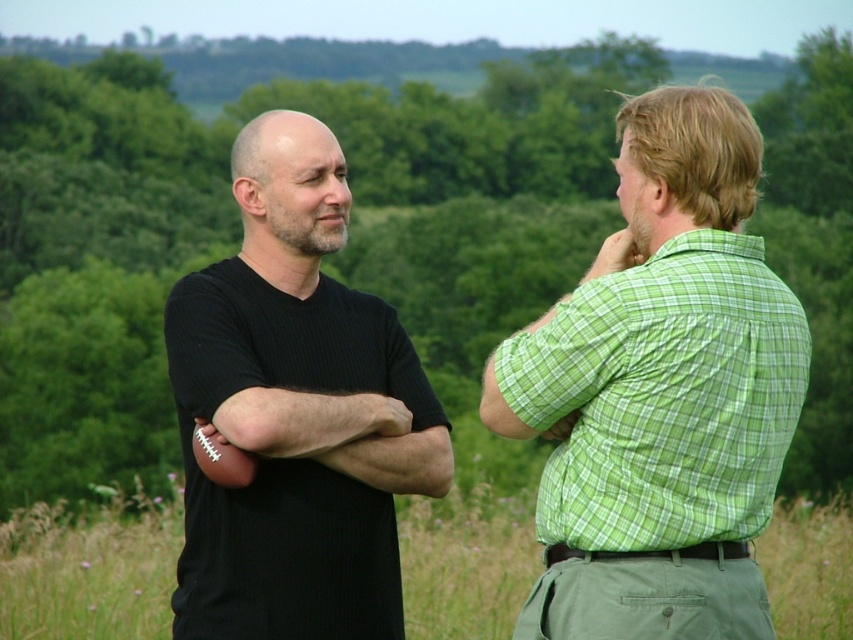
Question: Does green plaid shirt at right appear on the right side of green grass at center?

Choices:
 (A) yes
 (B) no

Answer: (B)

Question: Which of the following is the closest to the observer?

Choices:
 (A) black matte football at left
 (B) green plaid shirt at right

Answer: (B)

Question: Which object appears closest to the camera in this image?

Choices:
 (A) green grass at center
 (B) green plaid shirt at right

Answer: (B)

Question: Observing the image, what is the correct spatial positioning of green plaid shirt at right in reference to black matte football at left?

Choices:
 (A) above
 (B) below

Answer: (A)

Question: Which point appears closest to the camera in this image?

Choices:
 (A) (663, 236)
 (B) (248, 493)
 (C) (509, 580)

Answer: (A)

Question: Is black matte football at left above green grass at center?

Choices:
 (A) no
 (B) yes

Answer: (B)